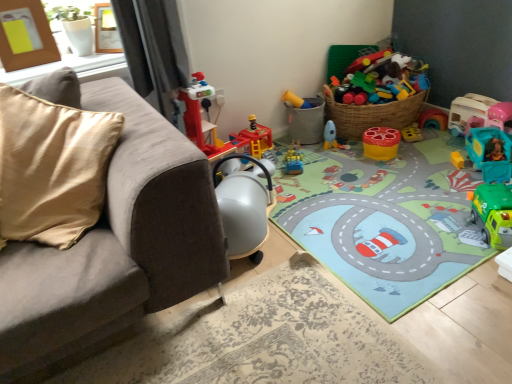
Locate an element on the screen. The width and height of the screenshot is (512, 384). vacant space that is in between matte plastic bucket at center, the 5th toy when ordered from right to left, and shiny yellow plastic train at center, which appears as the first toy when viewed from the left is located at coordinates (307, 150).